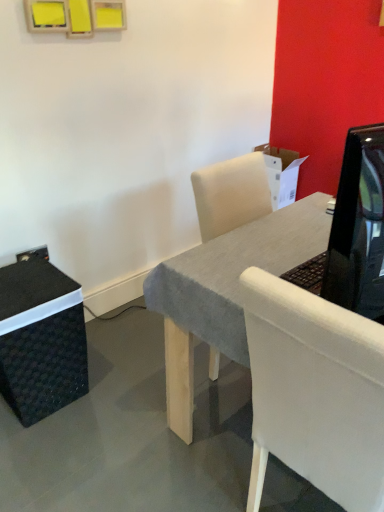
Question: From the image's perspective, is black woven box at lower left above or below white fabric chair at center?

Choices:
 (A) below
 (B) above

Answer: (B)

Question: In the image, is black woven box at lower left positioned in front of or behind white fabric chair at center?

Choices:
 (A) front
 (B) behind

Answer: (B)

Question: Which object is positioned closest to the shiny black tv at right?

Choices:
 (A) white fabric chair at center
 (B) textured gray desk at center
 (C) black woven box at lower left

Answer: (A)

Question: Which is farther from the textured gray desk at center?

Choices:
 (A) shiny black tv at right
 (B) white fabric chair at center
 (C) black woven box at lower left

Answer: (C)